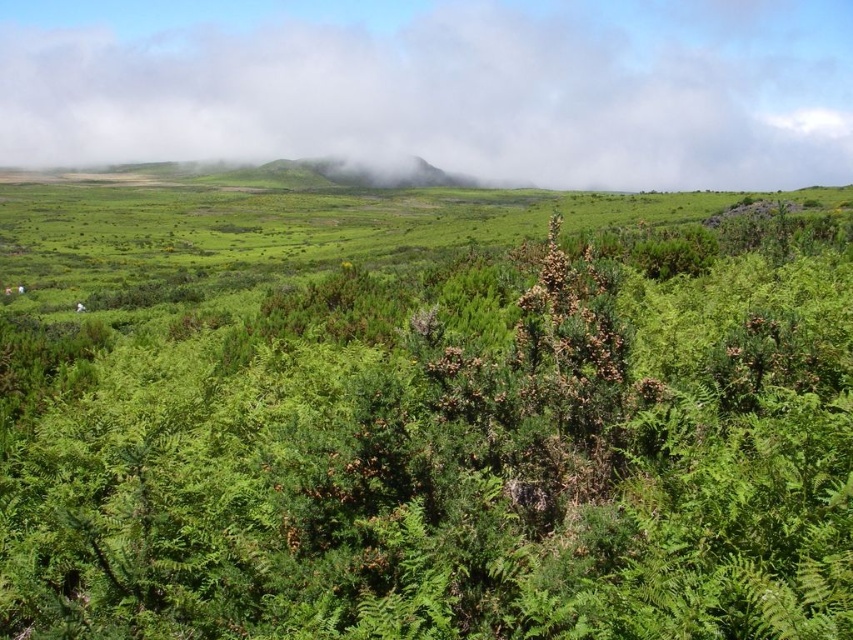
Question: Is green leafy shrub at center to the left of white fluffy cloud at upper center from the viewer's perspective?

Choices:
 (A) yes
 (B) no

Answer: (A)

Question: Does green leafy shrub at center have a smaller size compared to white fluffy cloud at upper center?

Choices:
 (A) yes
 (B) no

Answer: (A)

Question: Which point is farther to the camera?

Choices:
 (A) white fluffy cloud at upper center
 (B) green leafy shrub at center

Answer: (A)

Question: Does green leafy shrub at center have a lesser width compared to white fluffy cloud at upper center?

Choices:
 (A) yes
 (B) no

Answer: (A)

Question: Which point is farther to the camera?

Choices:
 (A) (749, 344)
 (B) (755, 164)

Answer: (B)